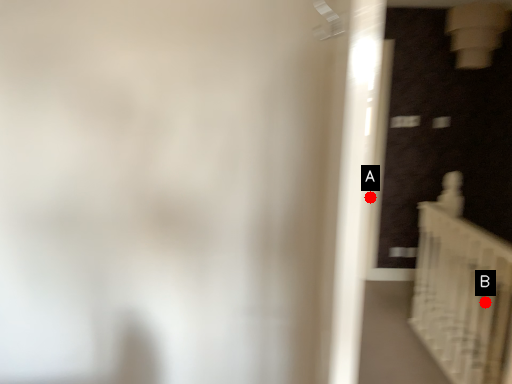
Question: Two points are circled on the image, labeled by A and B beside each circle. Which point is farther to the camera?

Choices:
 (A) A is further
 (B) B is further

Answer: (B)